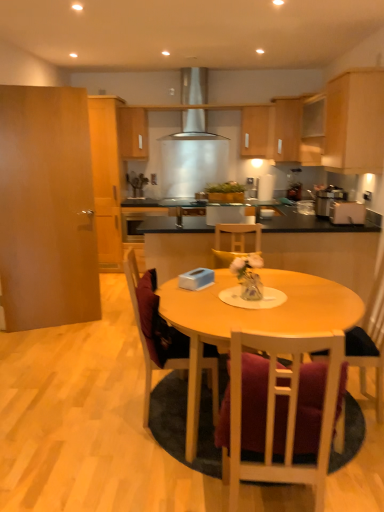
Identify the location of vacant area that lies to the right of brown wood door at left, which is counted as the 1th cabinetry, starting from the left. This screenshot has width=384, height=512. tap(101, 325).